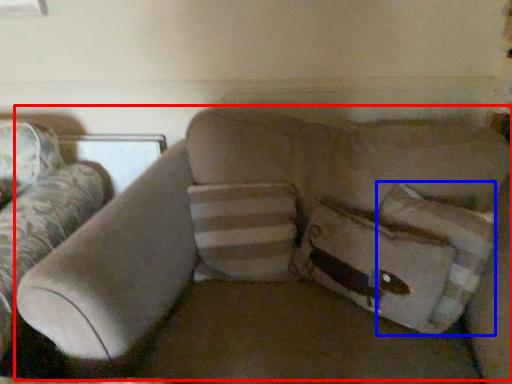
Question: Which object appears farthest to the camera in this image, couch (highlighted by a red box) or pillow (highlighted by a blue box)?

Choices:
 (A) couch
 (B) pillow

Answer: (B)